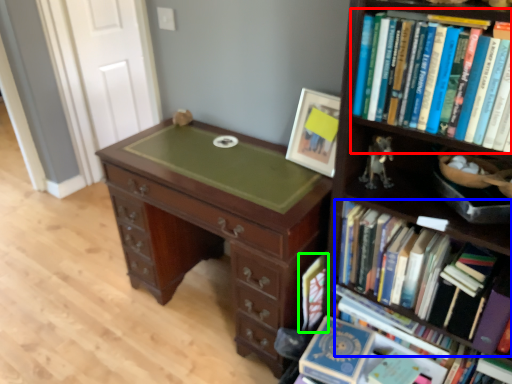
Question: Which is nearer to the book (highlighted by a red box)? book (highlighted by a blue box) or book (highlighted by a green box).

Choices:
 (A) book
 (B) book

Answer: (A)